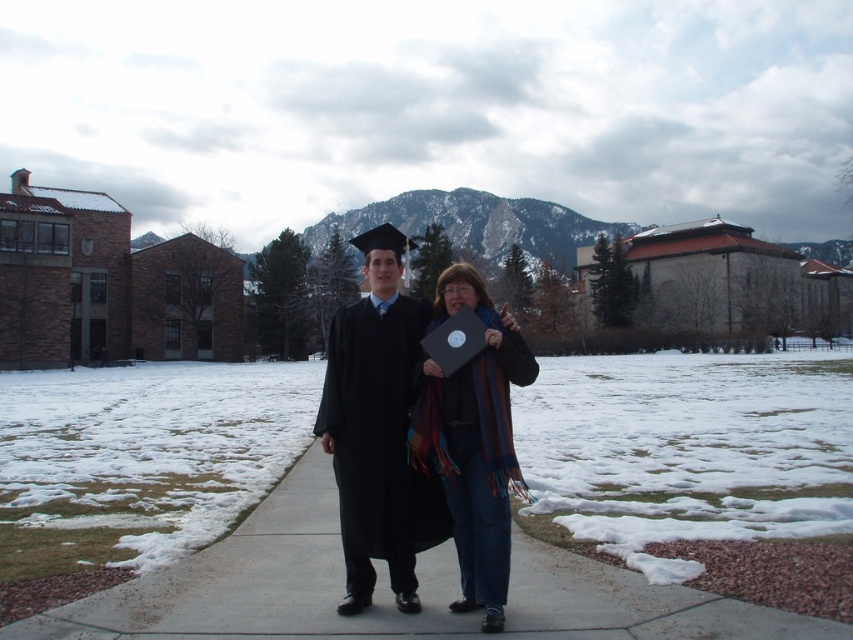
Is concrete at center bigger than blue striped scarf at center?

Incorrect, concrete at center is not larger than blue striped scarf at center.

Locate an element on the screen. concrete at center is located at coordinates (387, 588).

Is black matte graduation gown at center thinner than blue striped scarf at center?

Correct, black matte graduation gown at center's width is less than blue striped scarf at center's.

Who is more forward, (357,369) or (485,516)?

Point (485,516) is more forward.

Is point (347, 321) more distant than point (469, 360)?

Yes, it is.

Locate an element on the screen. black matte graduation gown at center is located at coordinates (378, 442).

Between concrete at center and matte black graduation gown at center, which one appears on the right side from the viewer's perspective?

Positioned to the right is concrete at center.

Between concrete at center and matte black graduation gown at center, which one is positioned higher?

matte black graduation gown at center is higher up.

Who is more distant from viewer, (534, 602) or (339, 312)?

Positioned behind is point (339, 312).

Locate an element on the screen. concrete at center is located at coordinates (387, 588).